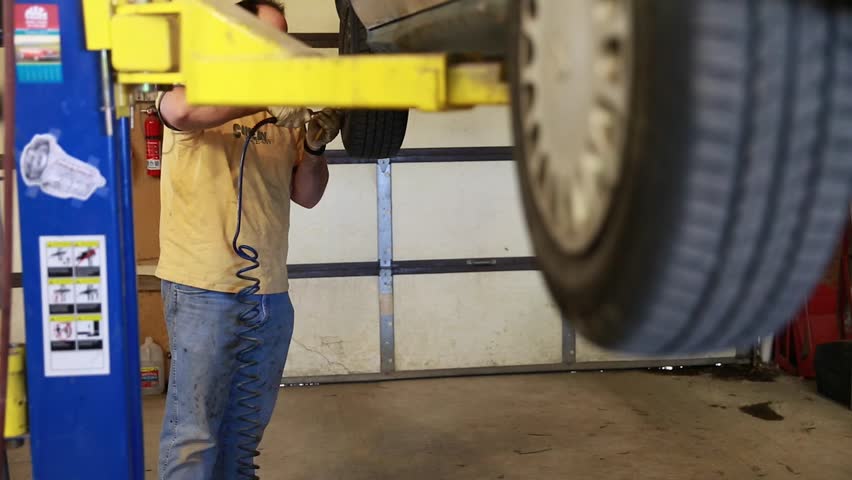
This screenshot has width=852, height=480. I want to click on brown wall, so click(x=144, y=204).